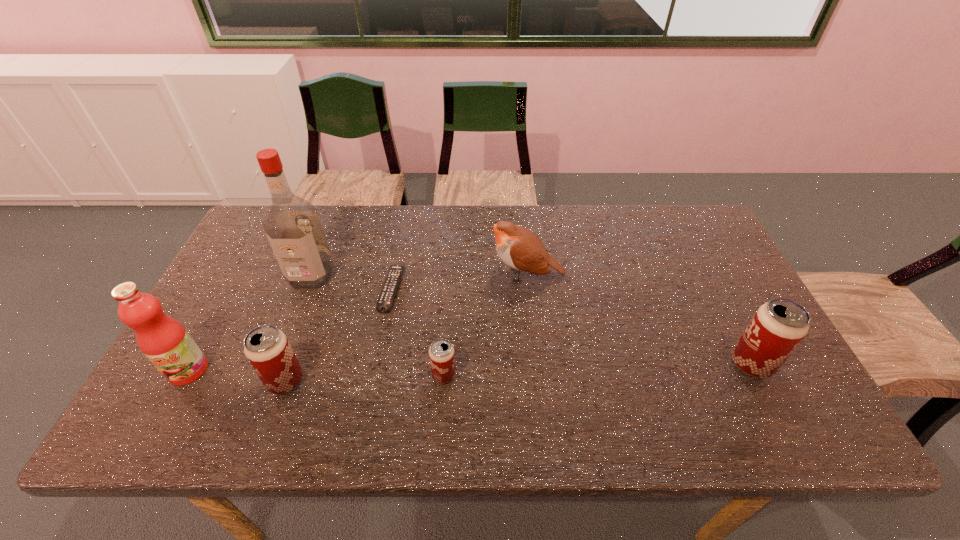
The image size is (960, 540). In order to click on the fifth tallest object in this screenshot , I will do coord(267,348).

Identify the location of the leftmost beer can. (267, 348).

The image size is (960, 540). Find the location of `the third object from right to left`. the third object from right to left is located at coordinates (441, 353).

I want to click on the second beer can from right to left, so click(x=441, y=353).

The image size is (960, 540). In order to click on the rightmost beer can in this screenshot , I will do `click(778, 326)`.

I want to click on the tallest object, so (292, 225).

Identify the location of the second object from right to left. This screenshot has width=960, height=540. coord(516,246).

In order to click on remote control in this screenshot , I will do `click(388, 292)`.

Where is `the shortest object`? the shortest object is located at coordinates (388, 292).

The image size is (960, 540). In order to click on fruit juice in this screenshot , I will do `click(164, 341)`.